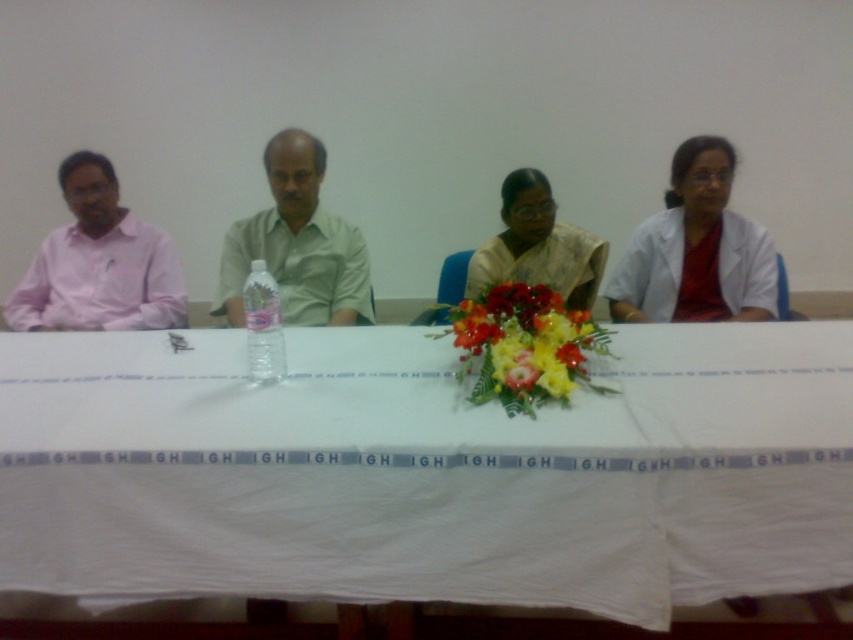
Does white cloth at center appear on the left side of vibrant floral bouquet at center?

Indeed, white cloth at center is positioned on the left side of vibrant floral bouquet at center.

Where is `white cloth at center`? The width and height of the screenshot is (853, 640). white cloth at center is located at coordinates (427, 472).

Does green matte shirt at center have a greater width compared to vibrant floral bouquet at center?

Yes, green matte shirt at center is wider than vibrant floral bouquet at center.

Between green matte shirt at center and vibrant floral bouquet at center, which one appears on the right side from the viewer's perspective?

Positioned to the right is vibrant floral bouquet at center.

The height and width of the screenshot is (640, 853). Describe the element at coordinates (299, 243) in the screenshot. I see `green matte shirt at center` at that location.

You are a GUI agent. You are given a task and a screenshot of the screen. Output one action in this format:
    pyautogui.click(x=<x>, y=<y>)
    Task: Click on the green matte shirt at center
    Image resolution: width=853 pixels, height=640 pixels.
    Given the screenshot: What is the action you would take?
    pyautogui.click(x=299, y=243)

Does white matte coat at right appear over satin yellow saree at center?

Correct, white matte coat at right is located above satin yellow saree at center.

Who is higher up, white matte coat at right or satin yellow saree at center?

white matte coat at right

What do you see at coordinates (695, 250) in the screenshot?
I see `white matte coat at right` at bounding box center [695, 250].

Identify the location of white matte coat at right. (695, 250).